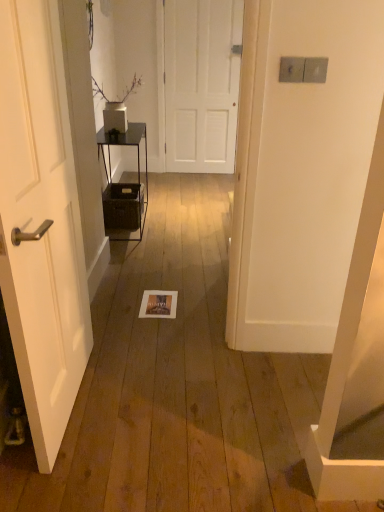
Question: In which direction should I rotate to look at white matte door at center, marked as the 1th door in a back-to-front arrangement?

Choices:
 (A) left
 (B) right

Answer: (B)

Question: Is metallic black shelf at center to the right of white matte door at center, the 1th door from the top, from the viewer's perspective?

Choices:
 (A) no
 (B) yes

Answer: (A)

Question: From the image's perspective, is metallic black shelf at center located beneath white matte door at center, marked as the 1th door in a back-to-front arrangement?

Choices:
 (A) no
 (B) yes

Answer: (B)

Question: From a real-world perspective, is metallic black shelf at center physically below white matte door at center, marked as the second door in a front-to-back arrangement?

Choices:
 (A) no
 (B) yes

Answer: (B)

Question: Would you say metallic black shelf at center is a long distance from white matte door at center, marked as the second door in a front-to-back arrangement?

Choices:
 (A) no
 (B) yes

Answer: (B)

Question: Is metallic black shelf at center positioned before white matte door at center, which is the 2th door from left to right?

Choices:
 (A) no
 (B) yes

Answer: (B)

Question: Can you confirm if metallic black shelf at center is thinner than white matte door at center, marked as the second door in a front-to-back arrangement?

Choices:
 (A) no
 (B) yes

Answer: (A)

Question: Is white matte door at left, the second door in the back-to-front sequence, not near metallic black shelf at center?

Choices:
 (A) yes
 (B) no

Answer: (A)

Question: Considering the relative sizes of white matte door at left, the second door in the back-to-front sequence, and metallic black shelf at center in the image provided, is white matte door at left, the second door in the back-to-front sequence, taller than metallic black shelf at center?

Choices:
 (A) no
 (B) yes

Answer: (B)

Question: Can you confirm if white matte door at left, the second door from the top, is shorter than metallic black shelf at center?

Choices:
 (A) yes
 (B) no

Answer: (B)

Question: Is white matte door at left, which is the first door from front to back, positioned behind metallic black shelf at center?

Choices:
 (A) yes
 (B) no

Answer: (B)

Question: From the image's perspective, is white matte door at left, the second door in the back-to-front sequence, below metallic black shelf at center?

Choices:
 (A) no
 (B) yes

Answer: (B)

Question: Is white matte door at left, which is the first door from front to back, turned away from metallic black shelf at center?

Choices:
 (A) yes
 (B) no

Answer: (B)

Question: From the image's perspective, would you say white matte door at center, the 1th door from the top, is shown under metallic black shelf at center?

Choices:
 (A) yes
 (B) no

Answer: (B)